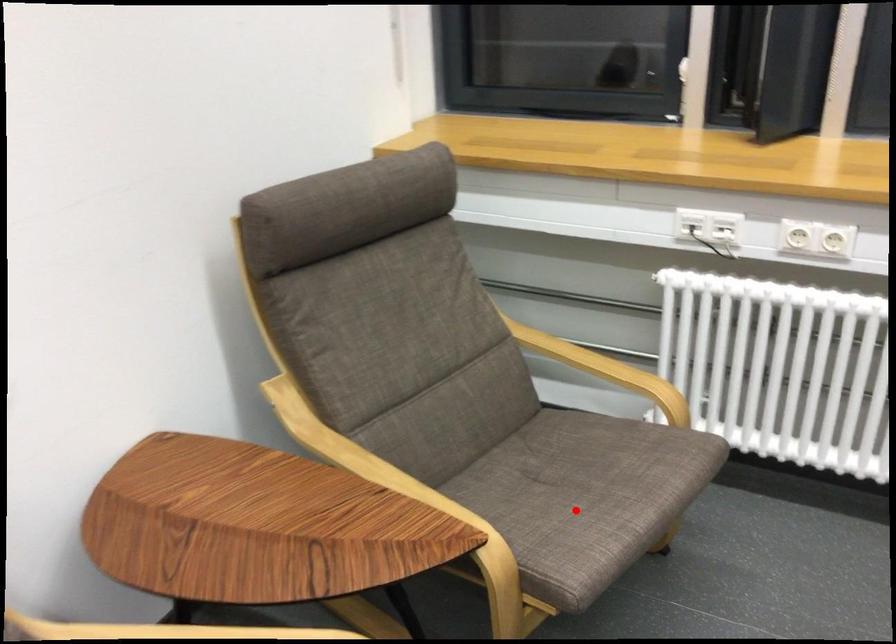
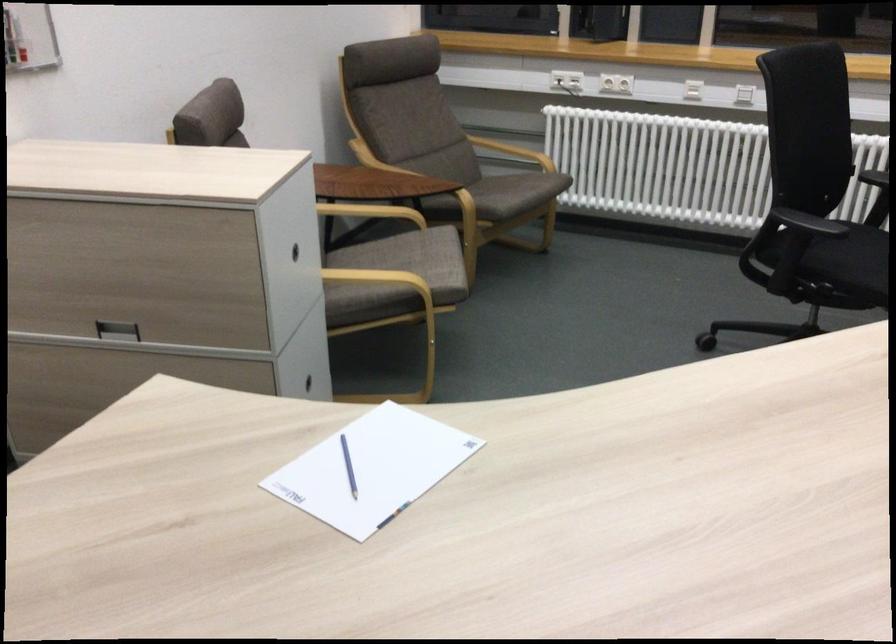
Where in the second image is the point corresponding to the highlighted location from the first image?

(510, 191)